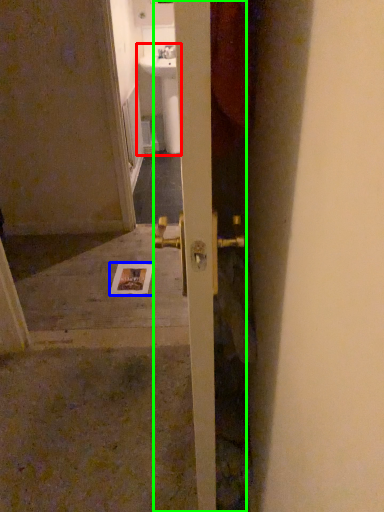
Question: Estimate the real-world distances between objects in this image. Which object is closer to sink (highlighted by a red box), postcard (highlighted by a blue box) or door (highlighted by a green box)?

Choices:
 (A) postcard
 (B) door

Answer: (A)